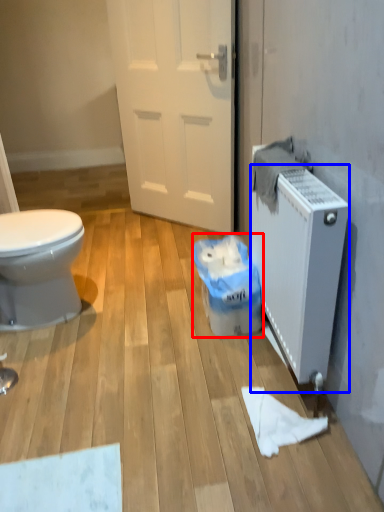
Question: Which object appears closest to the camera in this image, garbage (highlighted by a red box) or radiator (highlighted by a blue box)?

Choices:
 (A) garbage
 (B) radiator

Answer: (B)